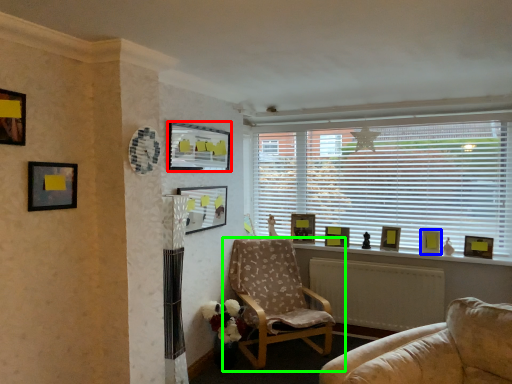
Question: Based on their relative distances, which object is nearer to picture frame (highlighted by a red box)? Choose from picture frame (highlighted by a blue box) and chair (highlighted by a green box).

Choices:
 (A) picture frame
 (B) chair

Answer: (B)